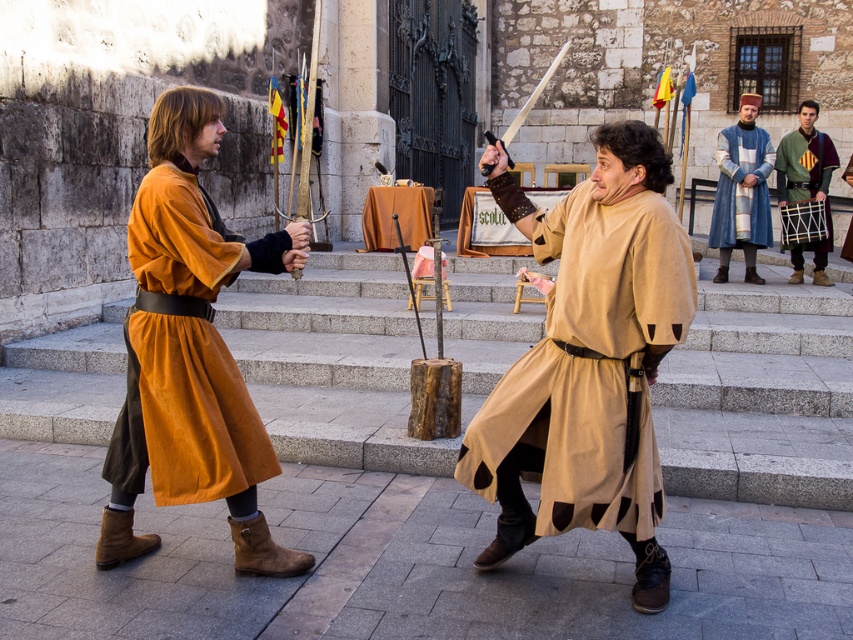
Question: Which point appears farthest from the camera in this image?

Choices:
 (A) coord(810,164)
 (B) coord(218,465)
 (C) coord(735,237)
 (D) coord(535,410)

Answer: (A)

Question: Can you confirm if beige fabric tunic at center is wider than blue woolen robe at upper right?

Choices:
 (A) no
 (B) yes

Answer: (B)

Question: Which point is farther to the camera?

Choices:
 (A) green woolen tunic at right
 (B) matte orange robe at left
 (C) beige fabric tunic at center

Answer: (A)

Question: Can you confirm if beige fabric tunic at center is thinner than green woolen tunic at right?

Choices:
 (A) no
 (B) yes

Answer: (A)

Question: Observing the image, what is the correct spatial positioning of beige fabric tunic at center in reference to green woolen tunic at right?

Choices:
 (A) right
 (B) left

Answer: (B)

Question: Which point appears closest to the camera in this image?

Choices:
 (A) (636, 317)
 (B) (788, 177)

Answer: (A)